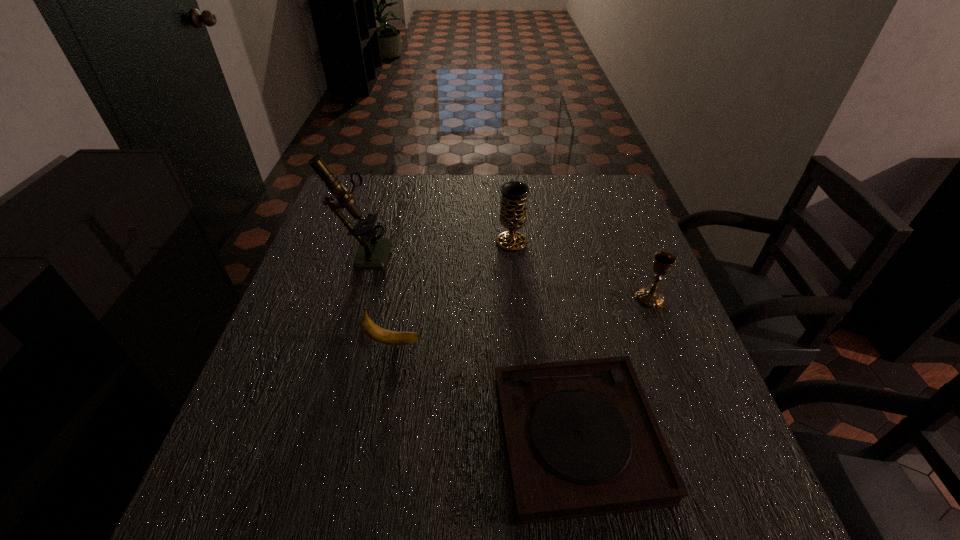
Where is `the tallest object`? This screenshot has height=540, width=960. the tallest object is located at coordinates (373, 252).

Locate an element on the screen. The width and height of the screenshot is (960, 540). the left chalice is located at coordinates (513, 214).

The width and height of the screenshot is (960, 540). What are the coordinates of `the farther chalice` in the screenshot? It's located at (513, 214).

Locate an element on the screen. the rightmost object is located at coordinates (649, 297).

Image resolution: width=960 pixels, height=540 pixels. Identify the location of the right chalice. (649, 297).

Identify the location of the fourth farthest object. This screenshot has height=540, width=960. (370, 329).

You are a GUI agent. You are given a task and a screenshot of the screen. Output one action in this format:
    pyautogui.click(x=<x>, y=<y>)
    Task: Click on the shortest object
    This screenshot has height=540, width=960.
    Given the screenshot: What is the action you would take?
    pyautogui.click(x=581, y=440)

Locate an element on the screen. Image resolution: width=960 pixels, height=540 pixels. phonograph record is located at coordinates (581, 440).

Locate an element on the screen. The width and height of the screenshot is (960, 540). free location located at the eyepiece of the microscope is located at coordinates (540, 253).

Locate an element on the screen. The width and height of the screenshot is (960, 540). free space located 0.160m on the back of the fourth shortest object is located at coordinates (508, 201).